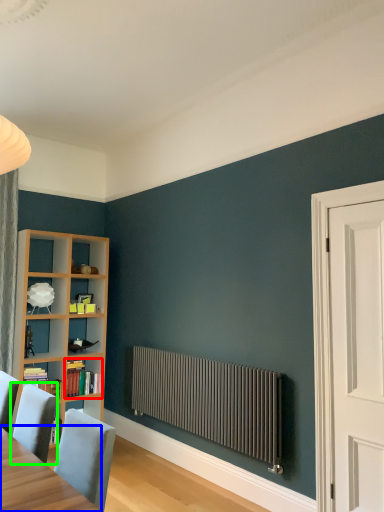
Question: Which object is the farthest from book (highlighted by a red box)? Choose among these: table (highlighted by a blue box) or chair (highlighted by a green box).

Choices:
 (A) table
 (B) chair

Answer: (A)